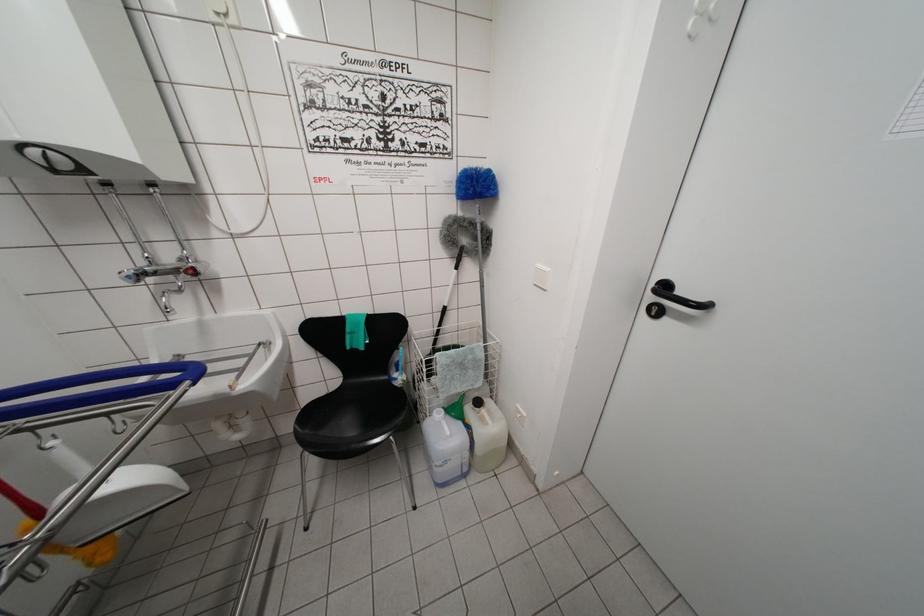
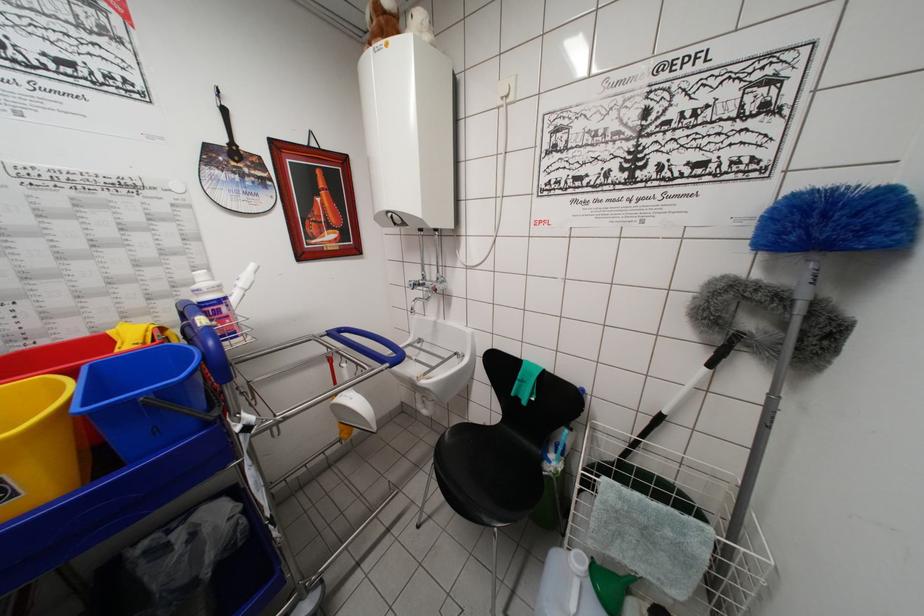
Locate, in the second image, the point that corresponds to (x=448, y=411) in the first image.

(601, 565)